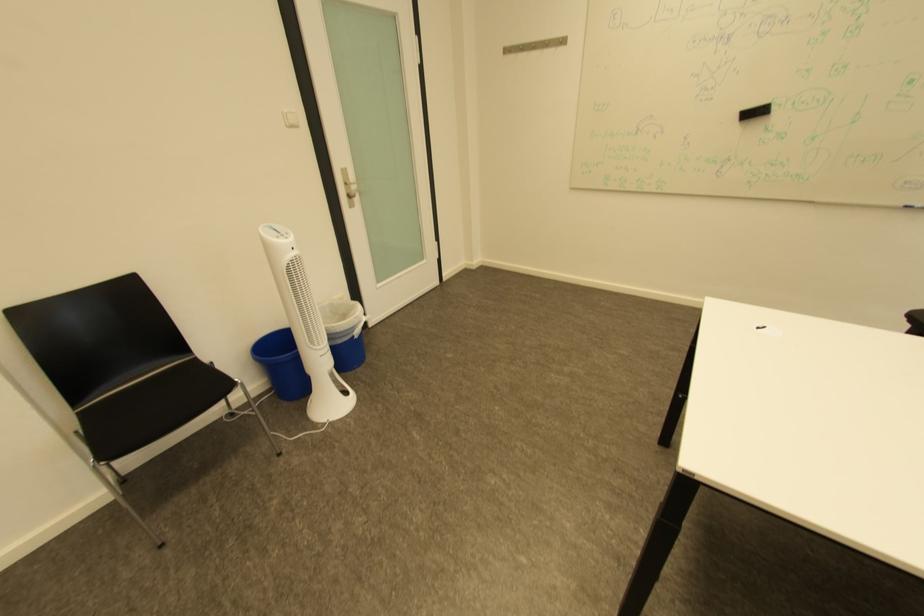
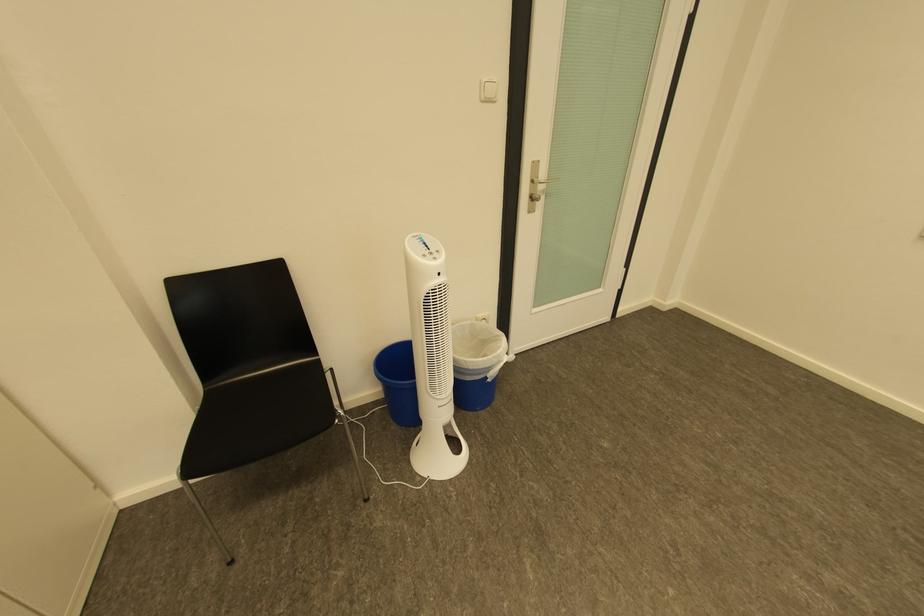
The point at (362, 330) is marked in the first image. Where is the corresponding point in the second image?

(499, 370)